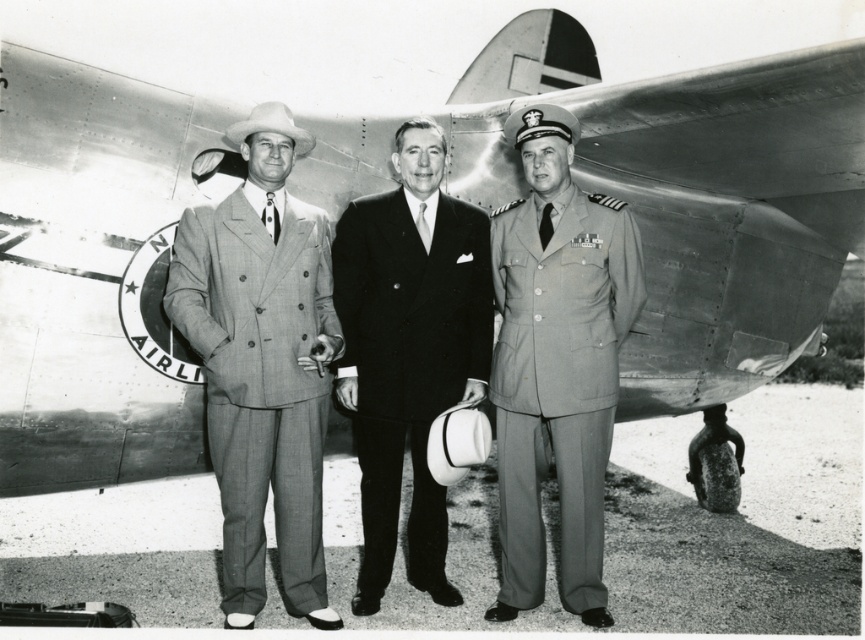
Based on the scene description, which object is placed above the other? Please choose between the plaid wool suit at center and the matte gray uniform at center.

The plaid wool suit at center is positioned over the matte gray uniform at center.

You are a photographer who wants to take a closer portrait of both the matte gray uniform at center and the smooth black suit at center. Given that your camera has a 12 inch focus range, will you be able to capture both subjects in one shot without moving the camera?

The matte gray uniform at center and the smooth black suit at center are 14.60 inches apart from each other. Since the camera can only focus within 12 inches, you will not be able to capture both subjects in one shot without moving the camera.